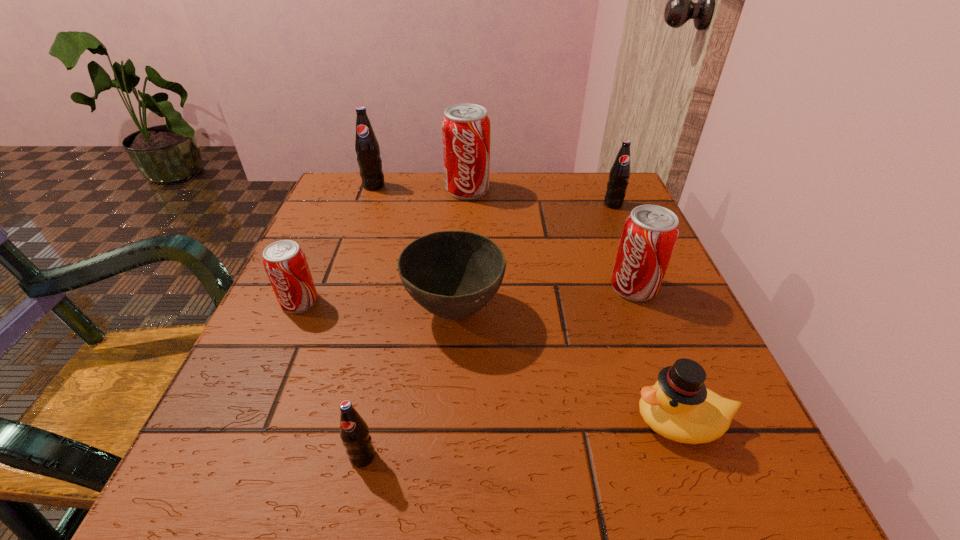
Locate an element on the screen. This screenshot has width=960, height=540. the biggest red soda can is located at coordinates (465, 127).

You are a GUI agent. You are given a task and a screenshot of the screen. Output one action in this format:
    pyautogui.click(x=<x>, y=<y>)
    Task: Click on the fourth pop from left to right
    
    Given the screenshot: What is the action you would take?
    pyautogui.click(x=465, y=127)

In order to click on the biggest black pop in this screenshot , I will do `click(367, 148)`.

At what (x,y) coordinates should I click in order to perform the action: click on the farthest black pop. Please return your answer as a coordinate pair (x, y). The width and height of the screenshot is (960, 540). Looking at the image, I should click on (367, 148).

This screenshot has height=540, width=960. I want to click on the second biggest black pop, so click(x=619, y=175).

The height and width of the screenshot is (540, 960). Find the location of `the second nearest black pop`. the second nearest black pop is located at coordinates (619, 175).

I want to click on the rightmost red soda can, so click(650, 232).

Where is `brown bowl`? brown bowl is located at coordinates (452, 274).

Identify the location of the smallest red soda can. Image resolution: width=960 pixels, height=540 pixels. pyautogui.click(x=285, y=262).

Find the location of a particular element. Image resolution: width=960 pixels, height=540 pixels. the smallest black pop is located at coordinates click(x=354, y=432).